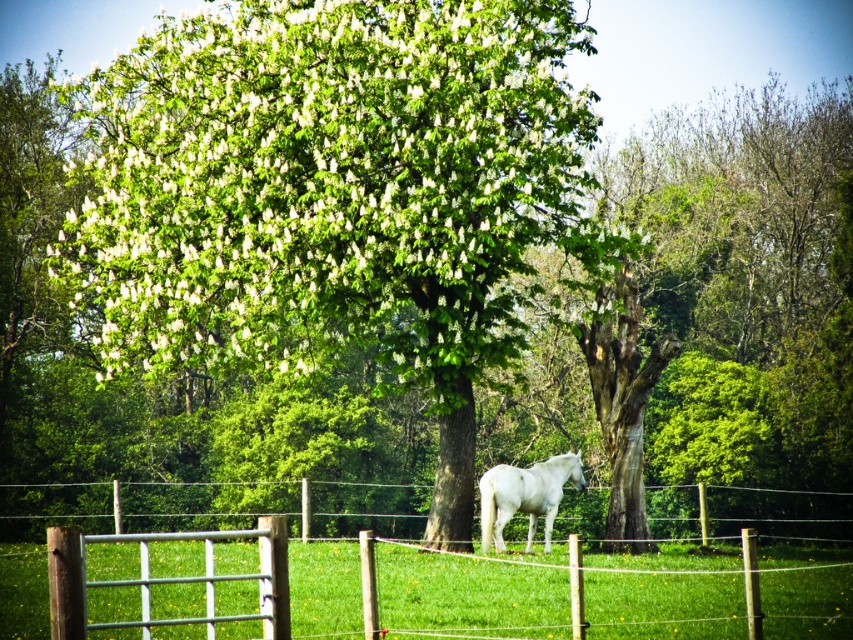
Based on the scene description, where is the point located at coordinate (338,193)?

The point at coordinate (338,193) is located at the green leafy tree at center.

You are a photographer trying to capture the white glossy horse at center in your shot. However, the green leafy tree at center is blocking your view. Can you move either object to get a clear shot of the horse?

The green leafy tree at center is closer to the viewer than the white glossy horse at center. To get a clear shot of the white glossy horse at center, you would need to move the green leafy tree at center out of the way or move the camera position to avoid the obstruction caused by the tree.

In the scene shown: You are a photographer trying to capture both the green leafy tree at center and the white glossy horse at center in a single frame. Based on their positions, which object should you adjust your camera angle to focus on first to ensure both are in the shot?

The green leafy tree at center is positioned on the left side of the white glossy horse at center. To capture both in a single frame, you should adjust your camera angle to focus on the white glossy horse at center first, as it is centrally located and the tree is to its left, allowing both to be framed together.